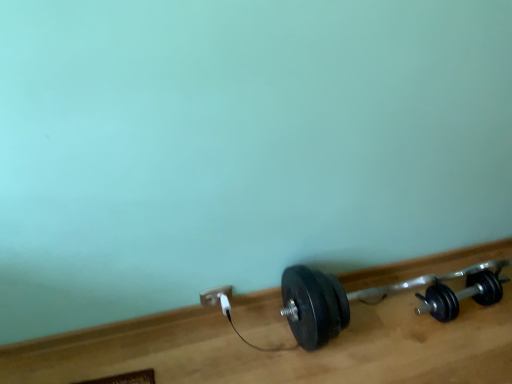
Locate an element on the screen. The height and width of the screenshot is (384, 512). free space that is in between white plastic plug at lower center and black rubber dumbbell at lower right, which is counted as the 2th dumbbell, starting from the right is located at coordinates (276, 328).